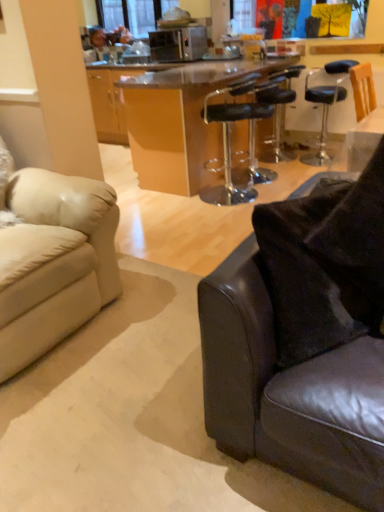
This screenshot has width=384, height=512. What do you see at coordinates (178, 44) in the screenshot?
I see `satin silver microwave oven at upper center` at bounding box center [178, 44].

Measure the distance between point (202,44) and camera.

Point (202,44) is 14.88 feet away from camera.

What is the approximate width of leather couch at lower right, the 2th studio couch in the left-to-right sequence?

The width of leather couch at lower right, the 2th studio couch in the left-to-right sequence, is 14.87 inches.

What do you see at coordinates (54, 262) in the screenshot?
I see `beige leather couch at left, the first studio couch in the left-to-right sequence` at bounding box center [54, 262].

At what (x,y) coordinates should I click in order to perform the action: click on transparent acrylic table at center. Please return your answer as a coordinate pair (x, y). This screenshot has width=384, height=512. Looking at the image, I should click on pos(180,122).

From a real-world perspective, is black leather bar stool at center, marked as the 1th chair in a right-to-left arrangement, on top of leather couch at lower right, acting as the first studio couch starting from the right?

No.

Between black leather bar stool at center, which is the second chair from front to back, and leather couch at lower right, the 2th studio couch in the left-to-right sequence, which one appears on the right side from the viewer's perspective?

Positioned to the right is black leather bar stool at center, which is the second chair from front to back.

Is black leather bar stool at center, which appears as the 2th chair when viewed from the left, wider or thinner than leather couch at lower right, the 2th studio couch in the left-to-right sequence?

Considering their sizes, black leather bar stool at center, which appears as the 2th chair when viewed from the left, looks broader than leather couch at lower right, the 2th studio couch in the left-to-right sequence.

Considering the sizes of black leather bar stool at center, which appears as the 2th chair when viewed from the left, and leather couch at lower right, acting as the first studio couch starting from the right, in the image, is black leather bar stool at center, which appears as the 2th chair when viewed from the left, taller or shorter than leather couch at lower right, acting as the first studio couch starting from the right,?

Clearly, black leather bar stool at center, which appears as the 2th chair when viewed from the left, is taller compared to leather couch at lower right, acting as the first studio couch starting from the right.

Is clear glass window screen at upper center wider than transparent acrylic table at center?

In fact, clear glass window screen at upper center might be narrower than transparent acrylic table at center.

Is clear glass window screen at upper center touching transparent acrylic table at center?

No, clear glass window screen at upper center is not beside transparent acrylic table at center.

How many degrees apart are the facing directions of clear glass window screen at upper center and transparent acrylic table at center?

The facing directions of clear glass window screen at upper center and transparent acrylic table at center are 89.7 degrees apart.

Based on the photo, is the position of clear glass window screen at upper center less distant than that of transparent acrylic table at center?

That is False.

Considering the points (211, 177) and (169, 0), which point is behind, point (211, 177) or point (169, 0)?

The point (169, 0) is more distant.

From a real-world perspective, who is located lower, transparent acrylic table at center or clear glass window screen at upper center?

In real-world perspective, transparent acrylic table at center is lower.

Is transparent acrylic table at center not near clear glass window screen at upper center?

That's right, there is a large distance between transparent acrylic table at center and clear glass window screen at upper center.

Looking at the image, does beige leather couch at left, the first studio couch in the left-to-right sequence, seem bigger or smaller compared to satin silver microwave oven at upper center?

In the image, beige leather couch at left, the first studio couch in the left-to-right sequence, appears to be larger than satin silver microwave oven at upper center.

From the image's perspective, which one is positioned lower, beige leather couch at left, the first studio couch in the left-to-right sequence, or satin silver microwave oven at upper center?

beige leather couch at left, the first studio couch in the left-to-right sequence, is shown below in the image.

Does beige leather couch at left, the first studio couch in the left-to-right sequence, have a greater width compared to satin silver microwave oven at upper center?

Correct, the width of beige leather couch at left, the first studio couch in the left-to-right sequence, exceeds that of satin silver microwave oven at upper center.

Which point is more forward, (24,260) or (195,54)?

The point (24,260) is closer.

Can you confirm if beige leather couch at left, which appears as the second studio couch when viewed from the right, is taller than transparent acrylic table at center?

Indeed, beige leather couch at left, which appears as the second studio couch when viewed from the right, has a greater height compared to transparent acrylic table at center.

From the image's perspective, which one is positioned higher, beige leather couch at left, the first studio couch in the left-to-right sequence, or transparent acrylic table at center?

From the image's view, transparent acrylic table at center is above.

Consider the image. Considering the sizes of objects beige leather couch at left, which appears as the second studio couch when viewed from the right, and transparent acrylic table at center in the image provided, who is bigger, beige leather couch at left, which appears as the second studio couch when viewed from the right, or transparent acrylic table at center?

Bigger between the two is transparent acrylic table at center.

Is beige leather couch at left, which appears as the second studio couch when viewed from the right, oriented towards transparent acrylic table at center?

No, beige leather couch at left, which appears as the second studio couch when viewed from the right, does not turn towards transparent acrylic table at center.

Based on the photo, is satin silver microwave oven at upper center bigger than beige leather couch at left, the first studio couch in the left-to-right sequence?

No, satin silver microwave oven at upper center is not bigger than beige leather couch at left, the first studio couch in the left-to-right sequence.

Can you confirm if satin silver microwave oven at upper center is wider than beige leather couch at left, the first studio couch in the left-to-right sequence?

Incorrect, the width of satin silver microwave oven at upper center does not surpass that of beige leather couch at left, the first studio couch in the left-to-right sequence.

Who is taller, satin silver microwave oven at upper center or beige leather couch at left, the first studio couch in the left-to-right sequence?

With more height is beige leather couch at left, the first studio couch in the left-to-right sequence.

Is leather couch at lower right, the 2th studio couch in the left-to-right sequence, aimed at transparent acrylic table at center?

No, leather couch at lower right, the 2th studio couch in the left-to-right sequence, does not turn towards transparent acrylic table at center.

From the image's perspective, does leather couch at lower right, the 2th studio couch in the left-to-right sequence, appear lower than transparent acrylic table at center?

Yes, from the image's perspective, leather couch at lower right, the 2th studio couch in the left-to-right sequence, is beneath transparent acrylic table at center.

How many degrees apart are the facing directions of leather couch at lower right, acting as the first studio couch starting from the right, and transparent acrylic table at center?

The angle between the facing direction of leather couch at lower right, acting as the first studio couch starting from the right, and the facing direction of transparent acrylic table at center is 151 degrees.

Which is more to the left, leather couch at lower right, the 2th studio couch in the left-to-right sequence, or transparent acrylic table at center?

Positioned to the left is transparent acrylic table at center.

Locate an element on the screen. The image size is (384, 512). chair to the right of leather couch at lower right, the 2th studio couch in the left-to-right sequence is located at coordinates (278, 110).

Locate an element on the screen. The width and height of the screenshot is (384, 512). table below the clear glass window screen at upper center (from the image's perspective) is located at coordinates [x=180, y=122].

Looking at the image, which one is located closer to satin silver microwave oven at upper center, black leather bar stool at center, which appears as the 2th chair when viewed from the left, or transparent plastic bar stool at center, the second chair in the right-to-left sequence?

black leather bar stool at center, which appears as the 2th chair when viewed from the left, is positioned closer to the anchor satin silver microwave oven at upper center.

Which object lies further to the anchor point transparent acrylic table at center, leather couch at lower right, the 2th studio couch in the left-to-right sequence, or black leather bar stool at center, arranged as the first chair when viewed from the back?

Based on the image, leather couch at lower right, the 2th studio couch in the left-to-right sequence, appears to be further to transparent acrylic table at center.

Which object lies further to the anchor point transparent plastic bar stool at center, the second chair in the right-to-left sequence, black leather bar stool at center, marked as the 1th chair in a right-to-left arrangement, or leather couch at lower right, the 2th studio couch in the left-to-right sequence?

leather couch at lower right, the 2th studio couch in the left-to-right sequence.

When comparing their distances from satin silver microwave oven at upper center, does black leather bar stool at center, arranged as the first chair when viewed from the back, or beige leather couch at left, the first studio couch in the left-to-right sequence, seem further?

beige leather couch at left, the first studio couch in the left-to-right sequence, is positioned further to the anchor satin silver microwave oven at upper center.

Based on the photo, which object lies further to the anchor point transparent plastic bar stool at center, the first chair when ordered from left to right, clear glass window screen at upper center or satin silver microwave oven at upper center?

Based on the image, clear glass window screen at upper center appears to be further to transparent plastic bar stool at center, the first chair when ordered from left to right.

When comparing their distances from transparent plastic bar stool at center, the second chair in the right-to-left sequence, does satin silver microwave oven at upper center or clear glass window screen at upper center seem further?

The object further to transparent plastic bar stool at center, the second chair in the right-to-left sequence, is clear glass window screen at upper center.

Which object lies further to the anchor point beige leather couch at left, the first studio couch in the left-to-right sequence, black leather bar stool at center, which appears as the 2th chair when viewed from the left, or transparent acrylic table at center?

black leather bar stool at center, which appears as the 2th chair when viewed from the left, is positioned further to the anchor beige leather couch at left, the first studio couch in the left-to-right sequence.

Based on their spatial positions, is black leather bar stool at center, marked as the 1th chair in a right-to-left arrangement, or beige leather couch at left, which appears as the second studio couch when viewed from the right, closer to transparent plastic bar stool at center, the first chair when ordered from left to right?

black leather bar stool at center, marked as the 1th chair in a right-to-left arrangement, is closer to transparent plastic bar stool at center, the first chair when ordered from left to right.

Where is `chair between clear glass window screen at upper center and transparent plastic bar stool at center, the first chair when ordered from left to right, in the vertical direction`? This screenshot has height=512, width=384. chair between clear glass window screen at upper center and transparent plastic bar stool at center, the first chair when ordered from left to right, in the vertical direction is located at coordinates (278, 110).

I want to click on table located between leather couch at lower right, acting as the first studio couch starting from the right, and satin silver microwave oven at upper center in the depth direction, so click(x=180, y=122).

The height and width of the screenshot is (512, 384). I want to click on table located between transparent plastic bar stool at center, the 2th chair positioned from the back, and satin silver microwave oven at upper center in the depth direction, so click(180, 122).

Locate an element on the screen. microwave oven located between leather couch at lower right, the 2th studio couch in the left-to-right sequence, and clear glass window screen at upper center in the depth direction is located at coordinates (178, 44).